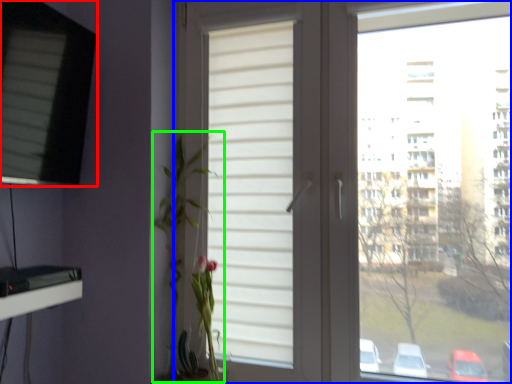
Question: Which is nearer to the window (highlighted by a red box)? window (highlighted by a blue box) or floral arrangement (highlighted by a green box).

Choices:
 (A) window
 (B) floral arrangement

Answer: (B)